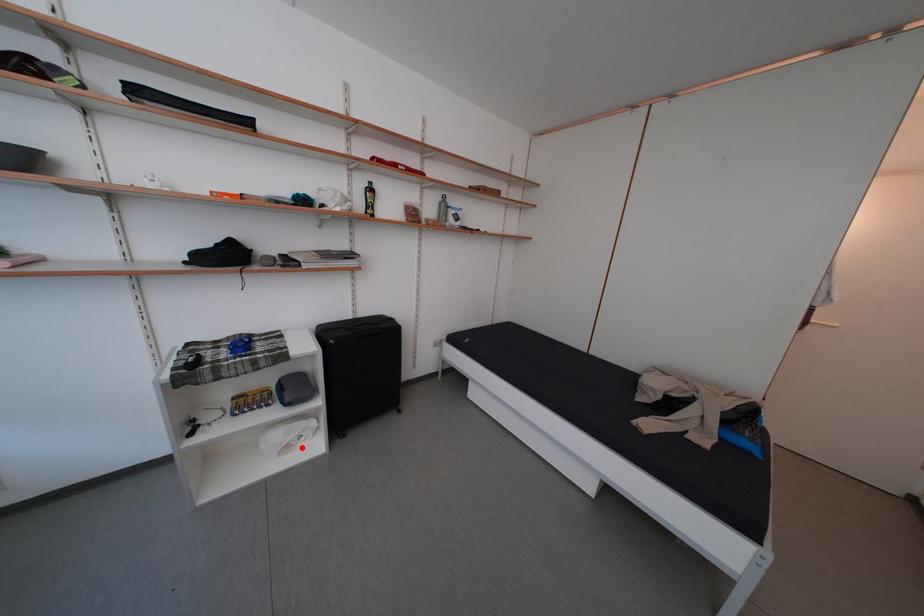
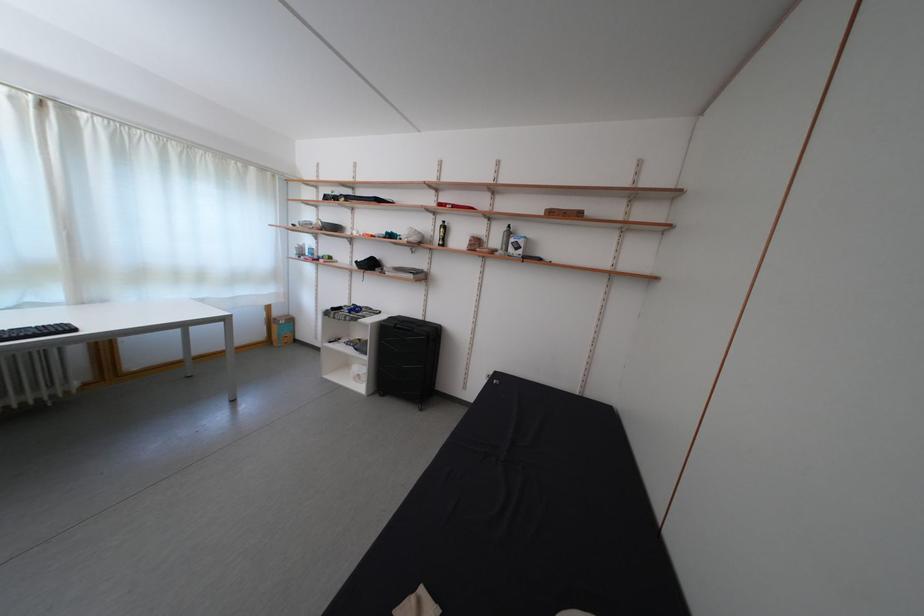
The point at the highlighted location is marked in the first image. Where is the corresponding point in the second image?

(365, 381)